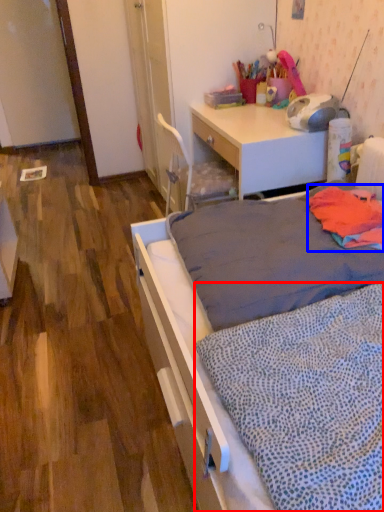
Question: Which point is further to the camera, blanket (highlighted by a red box) or blanket (highlighted by a blue box)?

Choices:
 (A) blanket
 (B) blanket

Answer: (B)